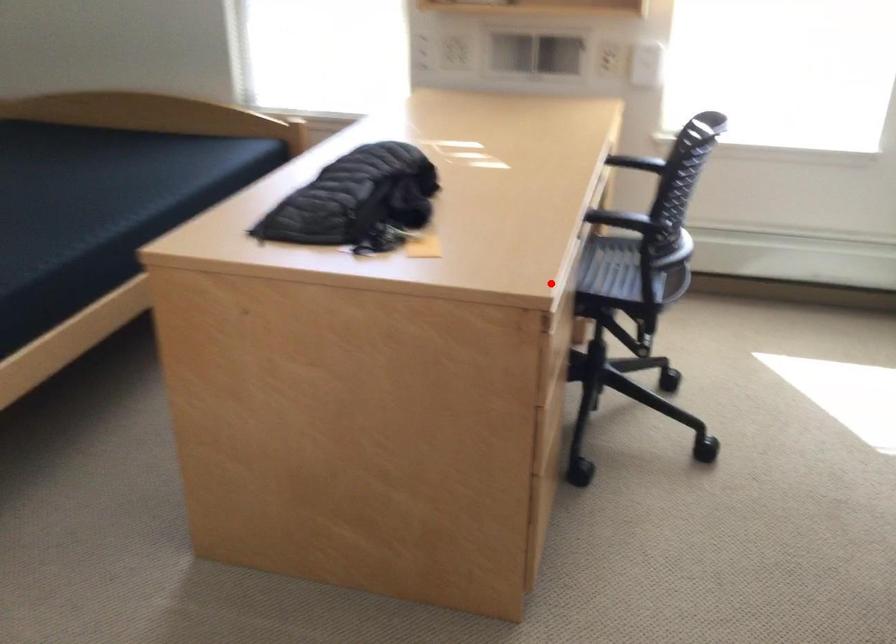
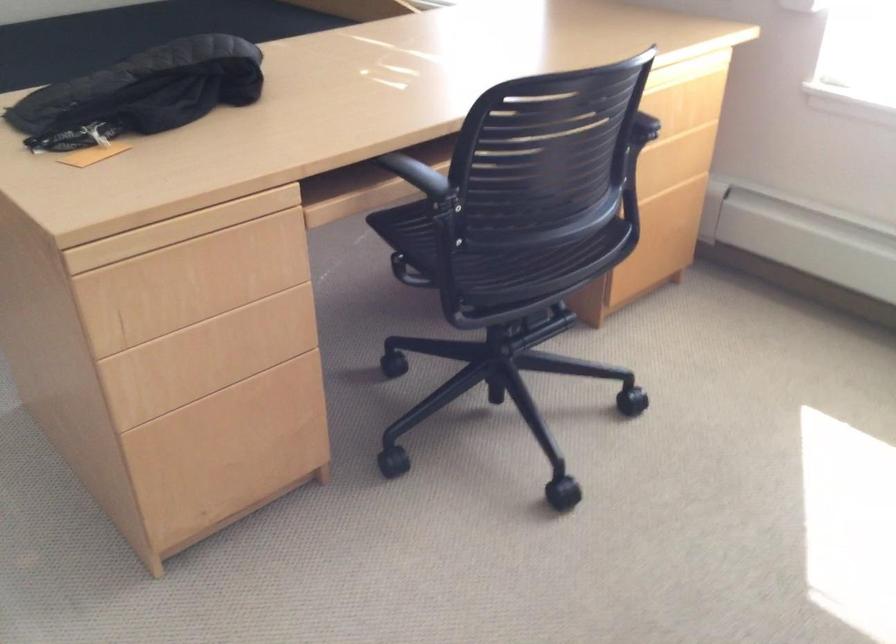
Locate, in the second image, the point that corresponds to the highlighted location in the first image.

(179, 229)